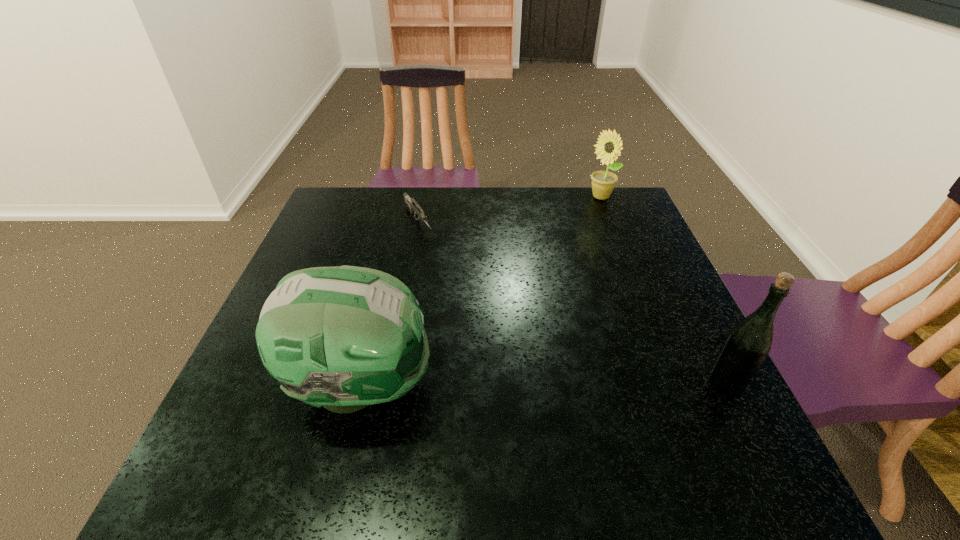
This screenshot has height=540, width=960. I want to click on free spot on the desktop that is between the football helmet and the rightmost object and is positioned on the face of the second object from right to left, so click(x=549, y=384).

At what (x,y) coordinates should I click in order to perform the action: click on free space on the desktop that is between the football helmet and the rightmost object and is positioned aimed along the barrel of the shortest object. Please return your answer as a coordinate pair (x, y). The height and width of the screenshot is (540, 960). Looking at the image, I should click on (543, 384).